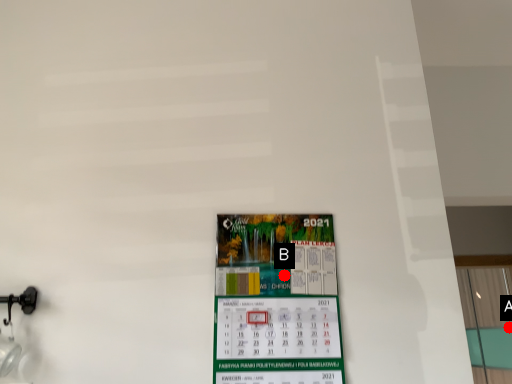
Question: Two points are circled on the image, labeled by A and B beside each circle. Which point is farther from the camera taking this photo?

Choices:
 (A) A is further
 (B) B is further

Answer: (A)